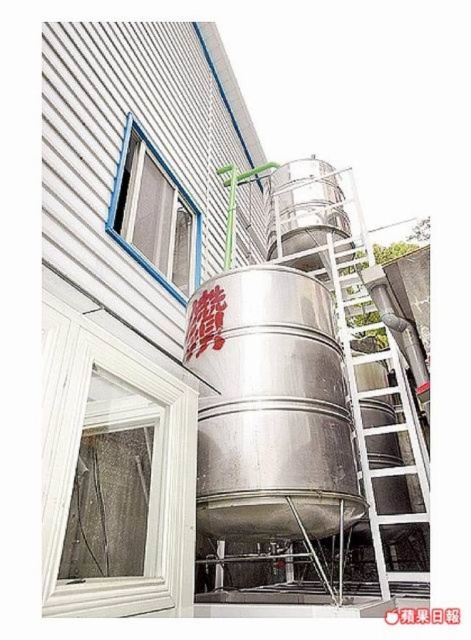
Can you confirm if metallic ladder at right is positioned below blue plastic window at upper left?

Indeed, metallic ladder at right is positioned under blue plastic window at upper left.

Can you confirm if metallic ladder at right is thinner than blue plastic window at upper left?

In fact, metallic ladder at right might be wider than blue plastic window at upper left.

The height and width of the screenshot is (640, 471). Find the location of `metallic ladder at right`. metallic ladder at right is located at coordinates (389, 404).